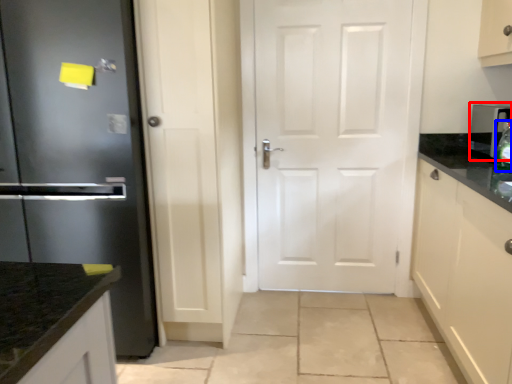
Question: Which of the following is the closest to the observer, appliance (highlighted by a red box) or bottle (highlighted by a blue box)?

Choices:
 (A) appliance
 (B) bottle

Answer: (B)